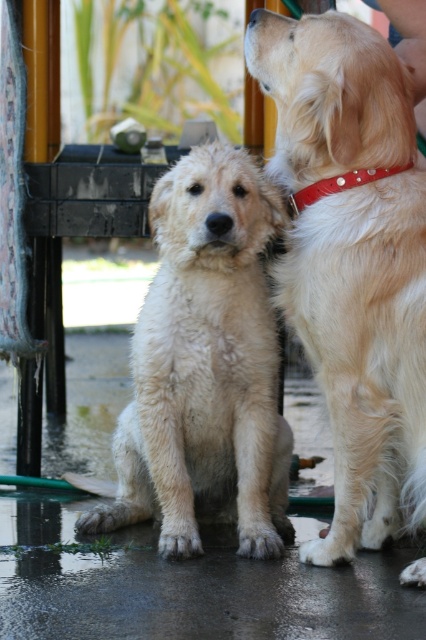
Question: Can you confirm if fuzzy white dog at center is positioned below red leather collar at upper right?

Choices:
 (A) yes
 (B) no

Answer: (A)

Question: Among these points, which one is nearest to the camera?

Choices:
 (A) (333, 372)
 (B) (172, 333)

Answer: (A)

Question: Is fuzzy white dog at center thinner than red leather collar at upper right?

Choices:
 (A) no
 (B) yes

Answer: (A)

Question: Which point appears closest to the camera in this image?

Choices:
 (A) (213, 236)
 (B) (385, 515)

Answer: (A)

Question: Is shiny golden fur at right bigger than fuzzy white dog at center?

Choices:
 (A) no
 (B) yes

Answer: (A)

Question: Among these points, which one is nearest to the camera?

Choices:
 (A) (356, 218)
 (B) (152, 198)

Answer: (A)